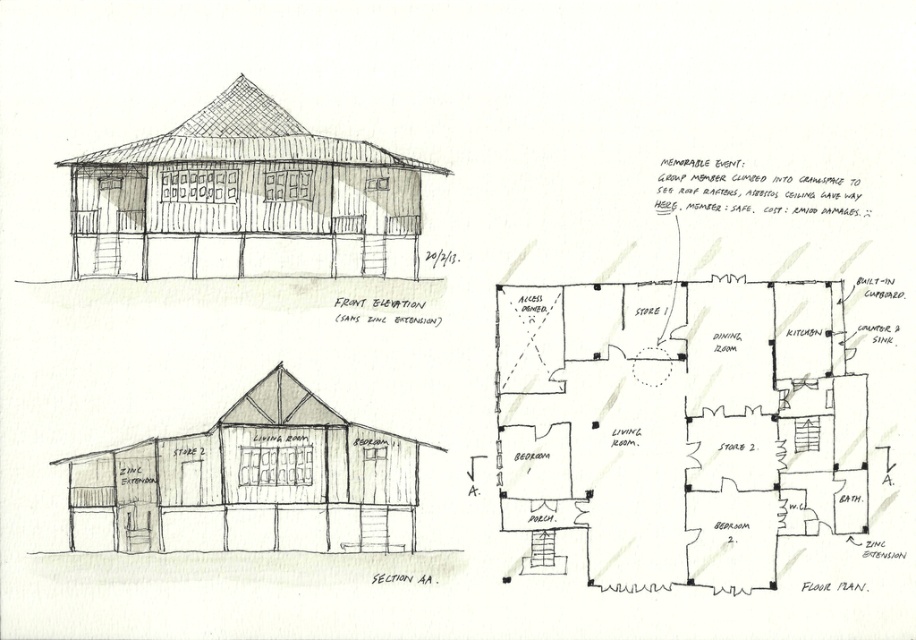
Does wooden planks barn at center have a smaller size compared to wooden hut at center?

Incorrect, wooden planks barn at center is not smaller in size than wooden hut at center.

Is wooden planks barn at center positioned in front of wooden hut at center?

No, wooden planks barn at center is further to the viewer.

Looking at this image, who is more distant from viewer, (271,186) or (280,483)?

The point (271,186) is more distant.

Where is `wooden planks barn at center`? wooden planks barn at center is located at coordinates (245, 200).